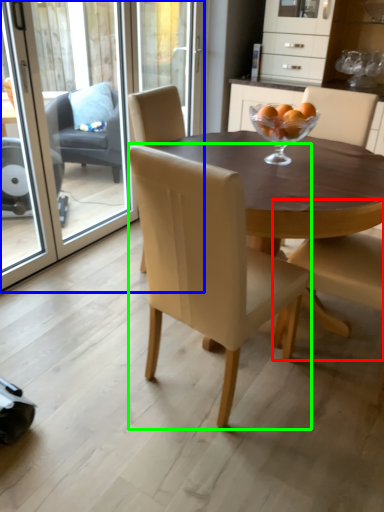
Question: Which is farther away from chair (highlighted by a red box)? screen door (highlighted by a blue box) or chair (highlighted by a green box)?

Choices:
 (A) screen door
 (B) chair

Answer: (A)